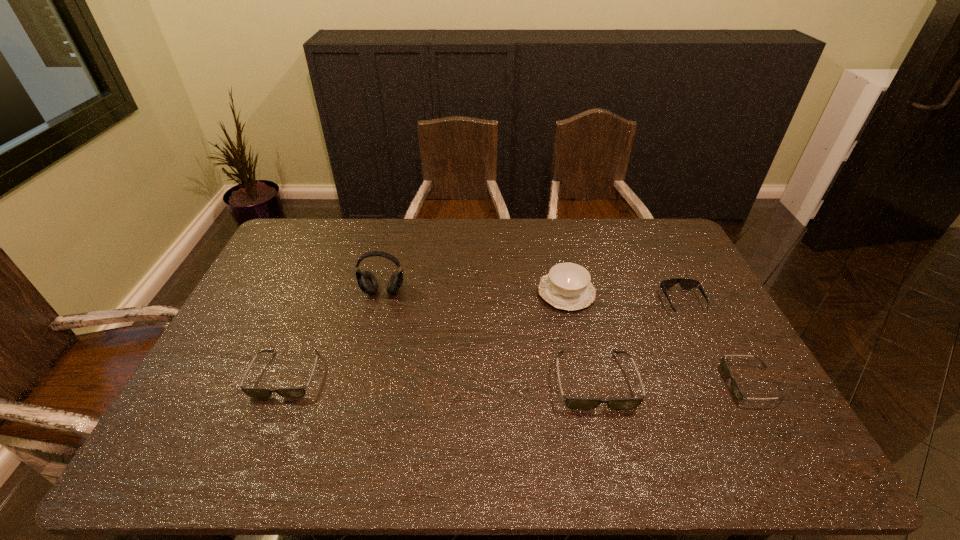
The height and width of the screenshot is (540, 960). I want to click on free location at the near edge, so click(x=669, y=418).

Find the location of a particular element. This screenshot has height=540, width=960. free spot at the left edge of the desktop is located at coordinates (262, 369).

The width and height of the screenshot is (960, 540). Find the location of `free spot at the far right corner of the desktop`. free spot at the far right corner of the desktop is located at coordinates (653, 247).

Identify the location of vacant area that lies between the farthest sunglasses and the second object from left to right. The width and height of the screenshot is (960, 540). (533, 296).

Where is `vacant point located between the fourth shortest object and the headset`? The image size is (960, 540). vacant point located between the fourth shortest object and the headset is located at coordinates (489, 336).

This screenshot has width=960, height=540. Find the location of `blank region between the headset and the farthest sunglasses`. blank region between the headset and the farthest sunglasses is located at coordinates pyautogui.click(x=533, y=296).

Where is `vacant space that is in between the second tallest object and the leftmost sunglasses`? This screenshot has width=960, height=540. vacant space that is in between the second tallest object and the leftmost sunglasses is located at coordinates (426, 334).

Locate an element on the screen. vacant point located between the shortest object and the third tallest object is located at coordinates (673, 382).

This screenshot has height=540, width=960. Identify the location of empty space between the chinaware and the farthest sunglasses. 624,298.

Where is `free area in between the shortest sunglasses and the farthest sunglasses`? The image size is (960, 540). free area in between the shortest sunglasses and the farthest sunglasses is located at coordinates (x=717, y=343).